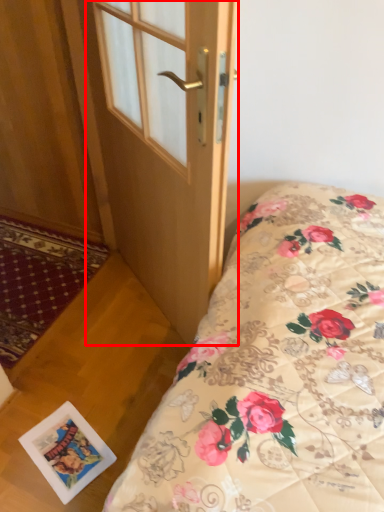
Question: From the image's perspective, where is door (annotated by the red box) located relative to postcard?

Choices:
 (A) above
 (B) below

Answer: (A)